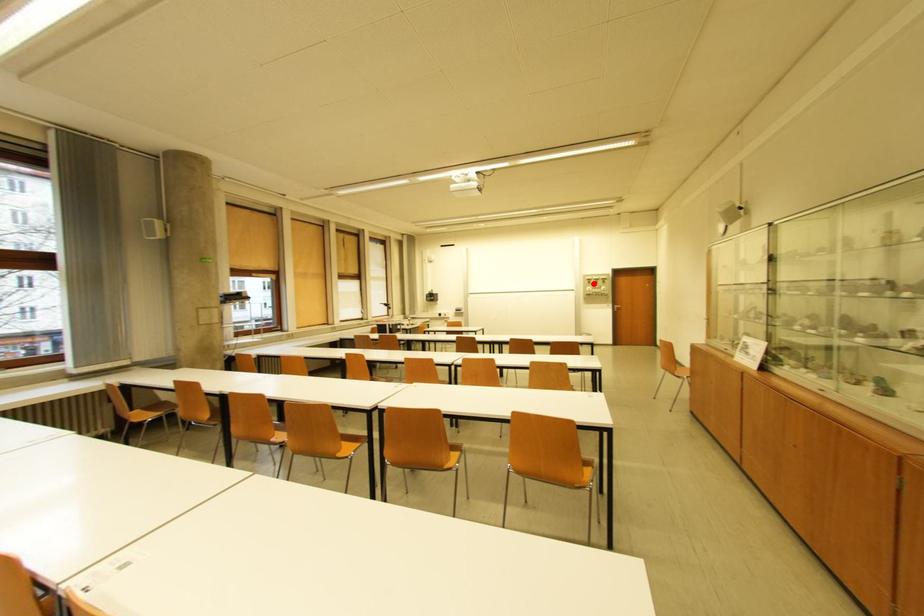
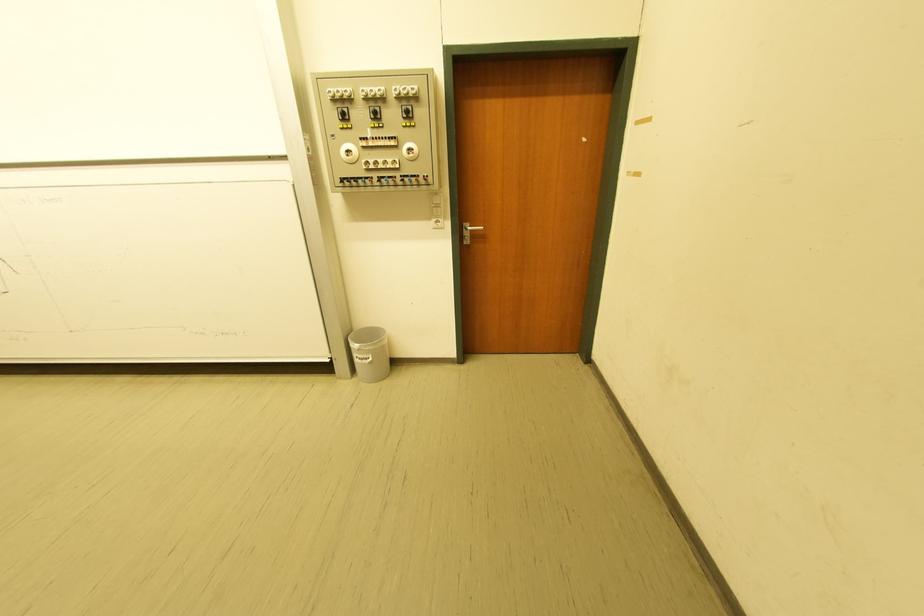
In the second image, find the point that corresponds to the highlighted location in the first image.

(342, 116)